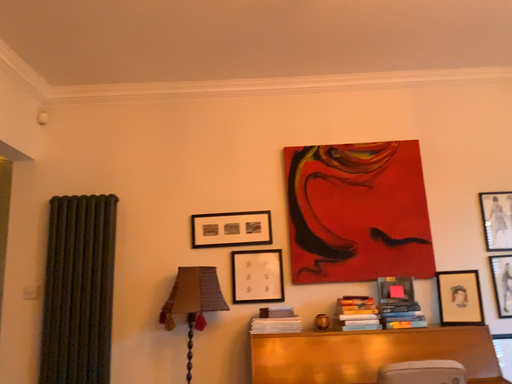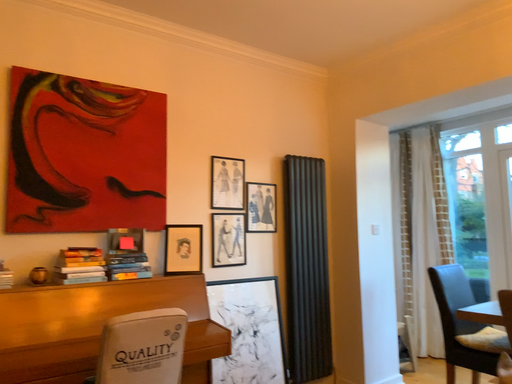
Question: How did the camera likely rotate when shooting the video?

Choices:
 (A) rotated upward
 (B) rotated downward

Answer: (B)